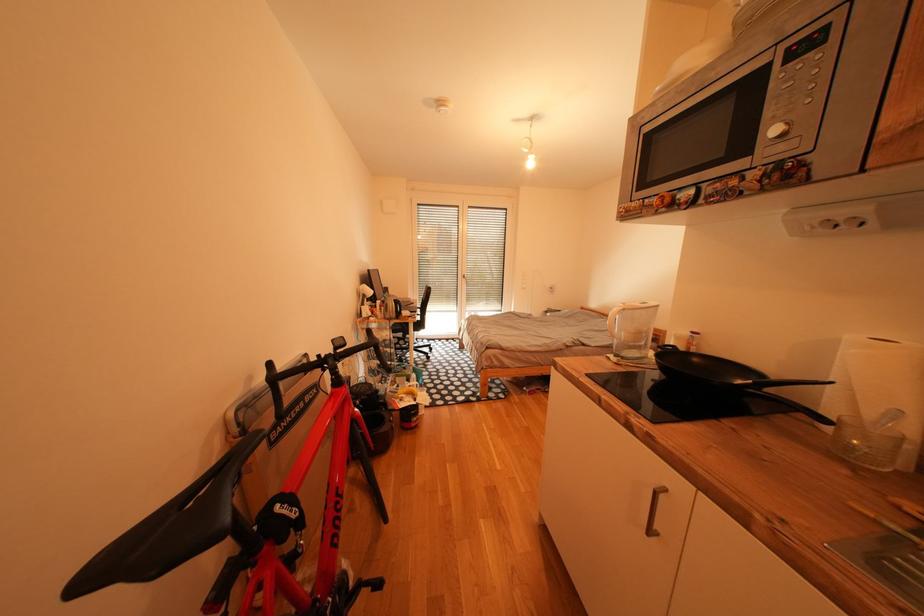
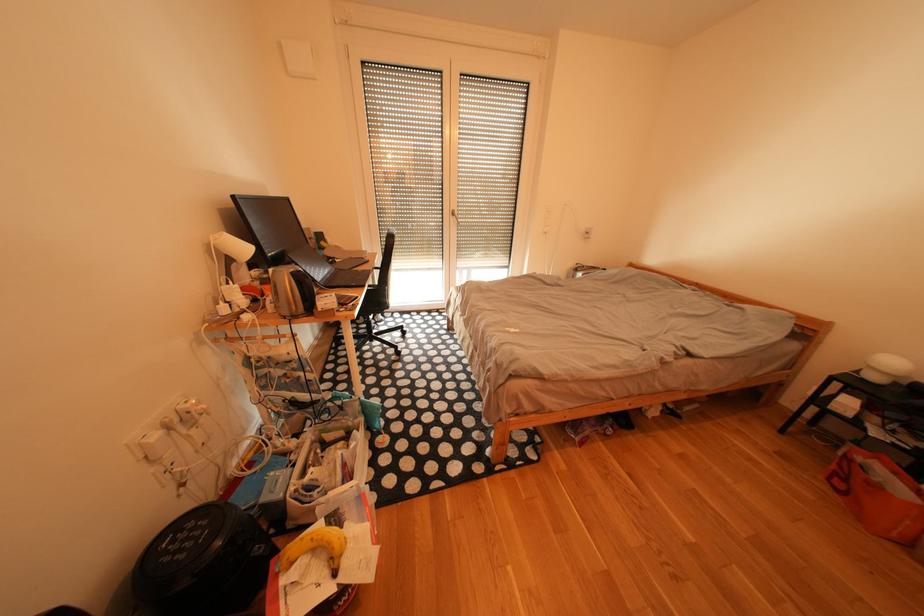
Question: In a continuous first-person perspective shot, in which direction is the camera moving?

Choices:
 (A) Left
 (B) Right
 (C) Forward
 (D) Backward

Answer: (C)